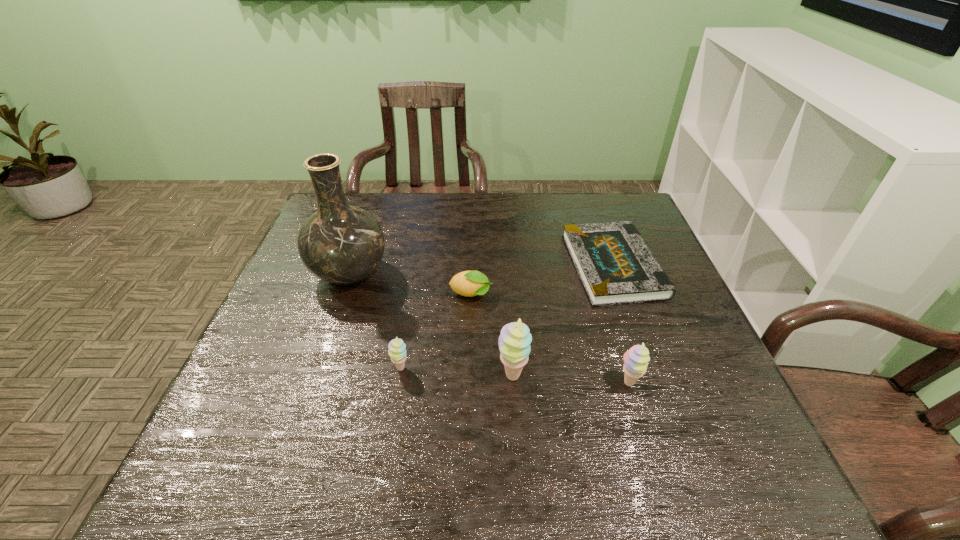
Identify the location of the second object from left to right. (397, 352).

Identify the location of the shortest sherbert. (397, 352).

Locate an element on the screen. This screenshot has height=540, width=960. the tallest sherbert is located at coordinates (514, 341).

Locate an element on the screen. the second sherbert from left to right is located at coordinates (514, 341).

At what (x,y) coordinates should I click in order to perform the action: click on the second tallest sherbert. Please return your answer as a coordinate pair (x, y). Looking at the image, I should click on (636, 359).

Locate an element on the screen. the third tallest object is located at coordinates (636, 359).

Find the location of a particular element. The width and height of the screenshot is (960, 540). the fourth object from right to left is located at coordinates (467, 283).

This screenshot has height=540, width=960. What are the coordinates of `the second shortest object` in the screenshot? It's located at (467, 283).

You are a GUI agent. You are given a task and a screenshot of the screen. Output one action in this format:
    pyautogui.click(x=<x>, y=<y>)
    Task: Click on the notebook
    This screenshot has height=540, width=960.
    Given the screenshot: What is the action you would take?
    pyautogui.click(x=615, y=265)

Locate an element on the screen. Image resolution: width=960 pixels, height=540 pixels. the tallest object is located at coordinates (342, 244).